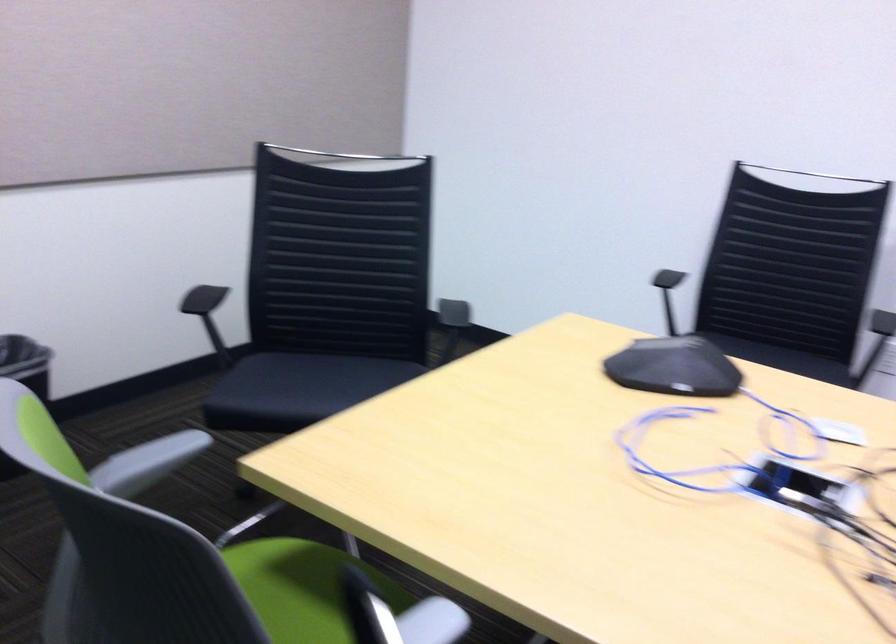
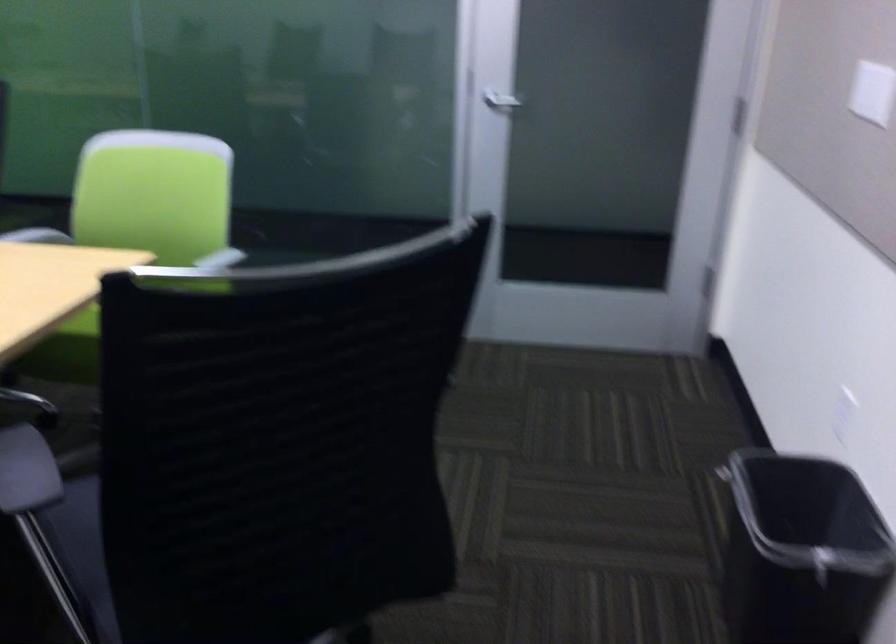
The point at (76, 328) is marked in the first image. Where is the corresponding point in the second image?

(800, 552)